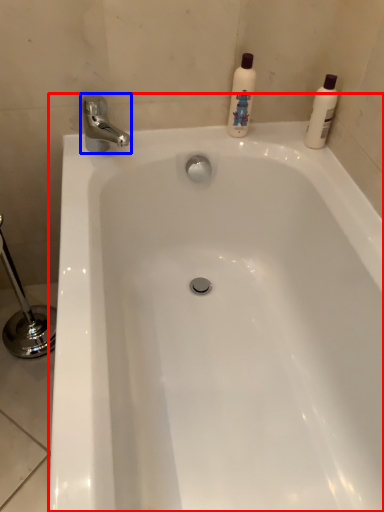
Question: Which object is further to the camera taking this photo, bathtub (highlighted by a red box) or tap (highlighted by a blue box)?

Choices:
 (A) bathtub
 (B) tap

Answer: (B)